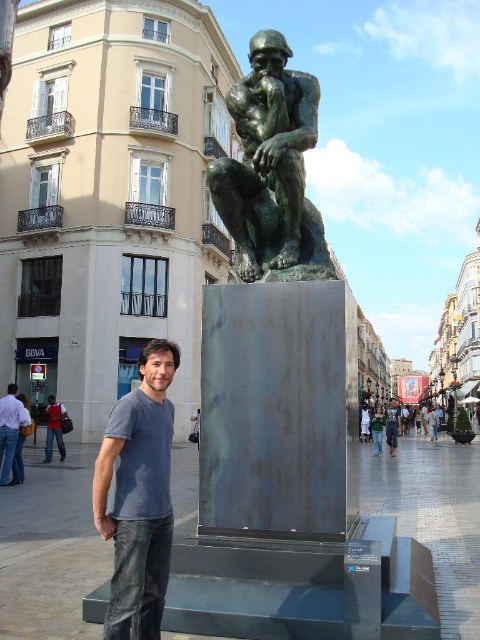
Between bronze statue at center and blue denim jeans at lower left, which one appears on the right side from the viewer's perspective?

Positioned to the right is bronze statue at center.

The width and height of the screenshot is (480, 640). Identify the location of bronze statue at center. point(272,168).

This screenshot has width=480, height=640. Describe the element at coordinates (272, 168) in the screenshot. I see `bronze statue at center` at that location.

Is bronze statue at center smaller than gray cotton shirt at center?

No.

Who is more forward, (288,198) or (22,412)?

Point (288,198) is in front.

The height and width of the screenshot is (640, 480). I want to click on bronze statue at center, so click(x=272, y=168).

Does blue denim jeans at lower left have a greater height compared to gray cotton shirt at center?

Yes, blue denim jeans at lower left is taller than gray cotton shirt at center.

Between point (132, 618) and point (0, 422), which one is positioned behind?

The point (0, 422) is more distant.

Who is more forward, (136, 456) or (9, 428)?

Point (136, 456)

The width and height of the screenshot is (480, 640). What are the coordinates of `blue denim jeans at lower left` in the screenshot? It's located at (139, 497).